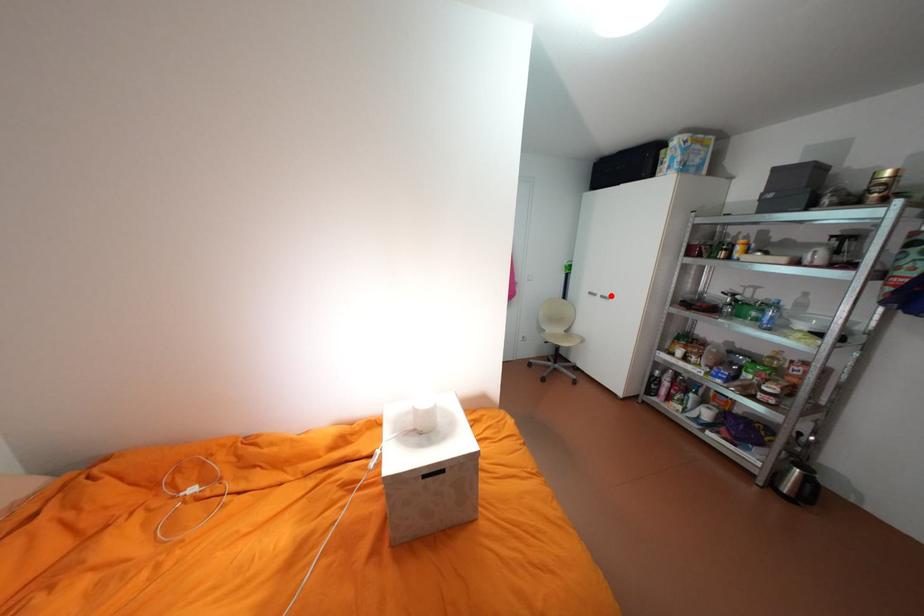
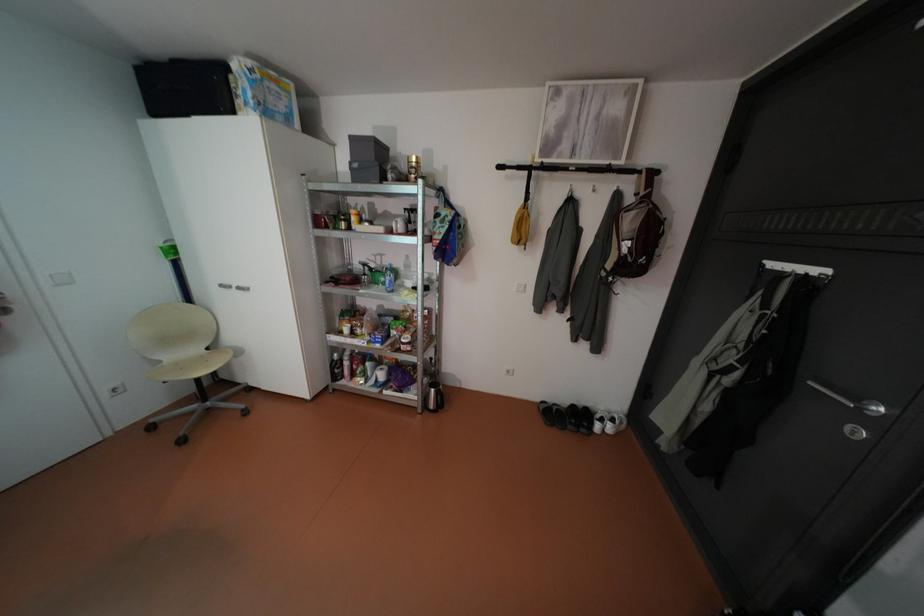
Where in the second image is the point corresponding to the highlighted location from the first image?

(248, 286)